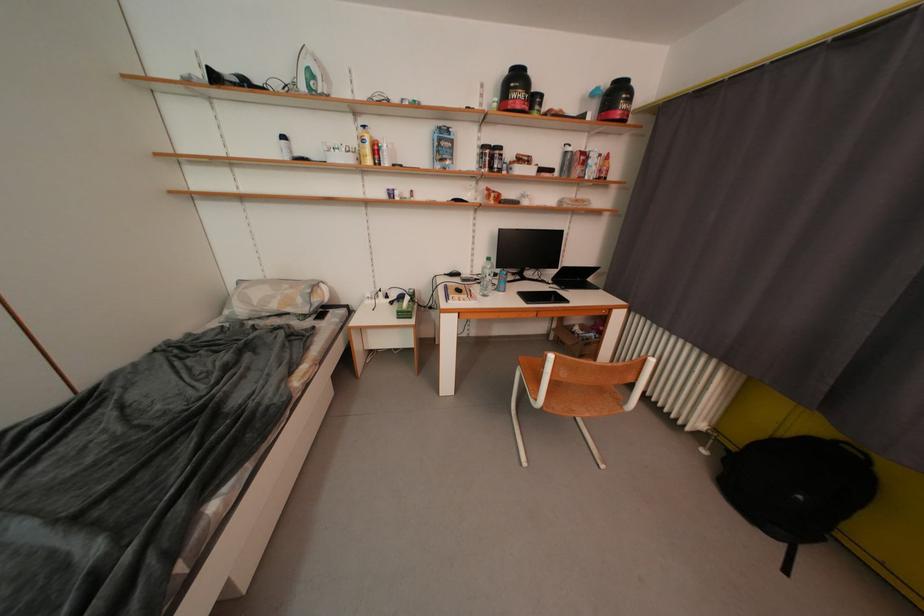
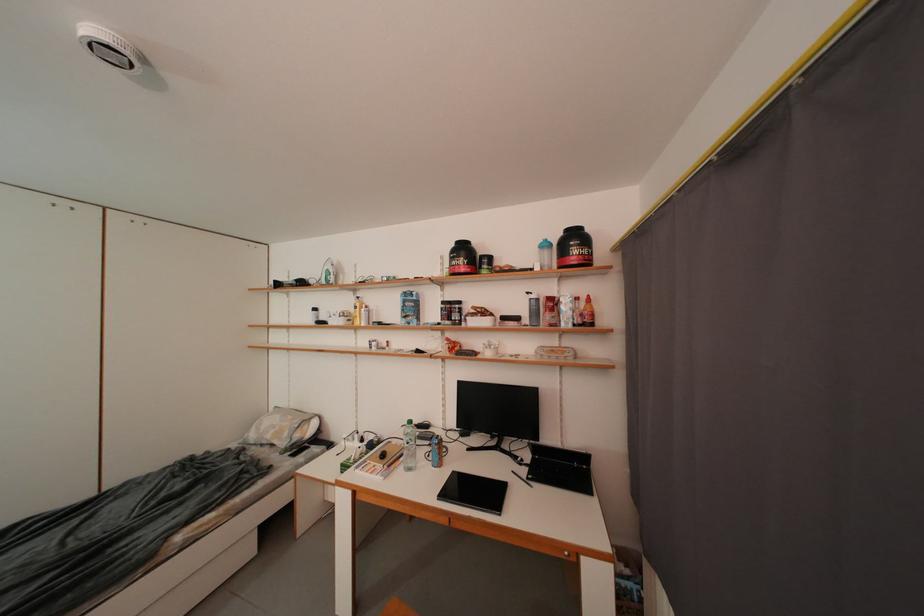
Where in the second image is the point corresponding to [467,294] from the first image?

(391, 459)